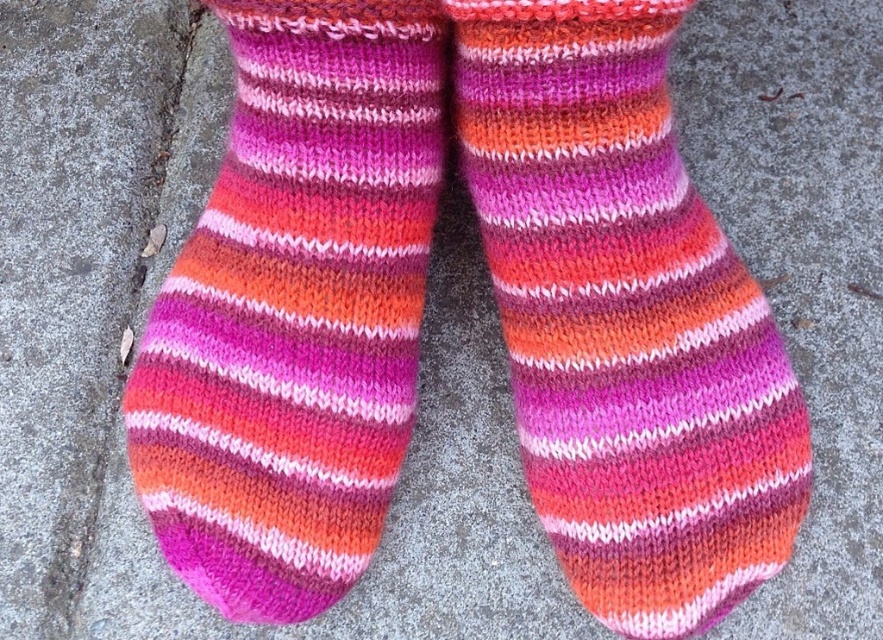
Between striped wool sock at center and striped woolen sock at center, which one has more height?

striped woolen sock at center is taller.

Which is behind, point (567, 572) or point (326, 355)?

Point (567, 572)

Is point (572, 461) closer to camera compared to point (189, 385)?

Yes, point (572, 461) is closer to viewer.

Locate an element on the screen. The height and width of the screenshot is (640, 883). striped wool sock at center is located at coordinates (624, 317).